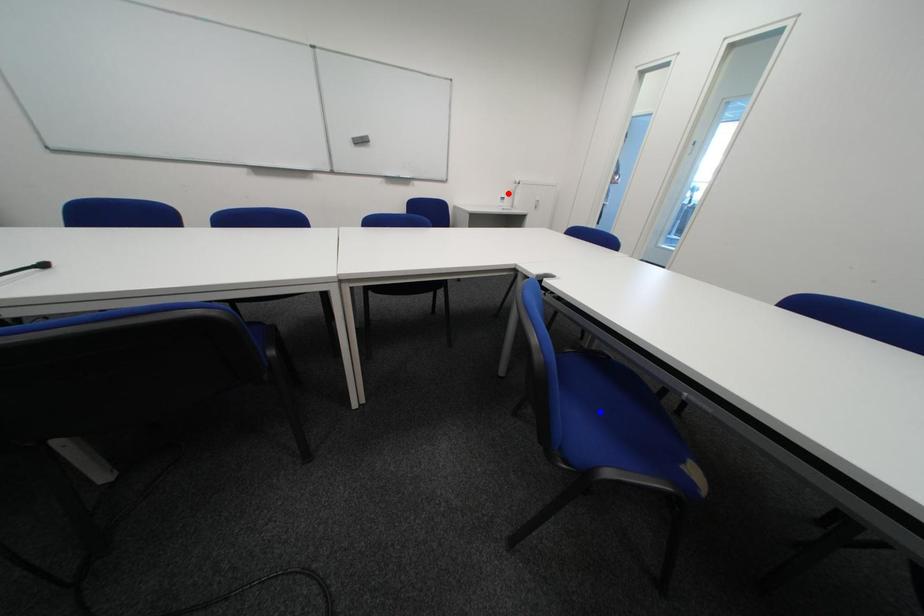
Question: Two points are marked on the image. Which point is closer to the camera?

Choices:
 (A) Blue point is closer.
 (B) Red point is closer.

Answer: (A)